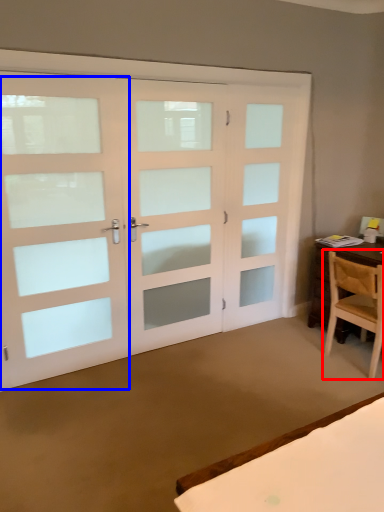
Question: Which of the following is the closest to the observer, chair (highlighted by a red box) or screen door (highlighted by a blue box)?

Choices:
 (A) chair
 (B) screen door

Answer: (B)